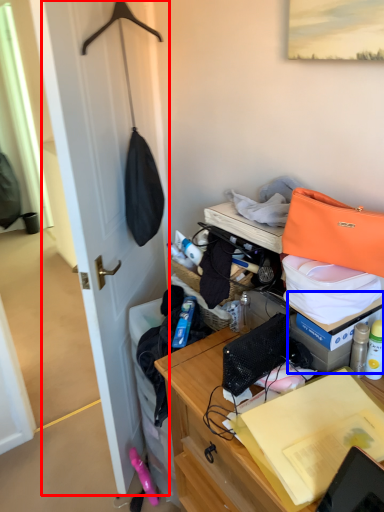
Question: Which of the following is the closest to the observer, door (highlighted by a red box) or box (highlighted by a blue box)?

Choices:
 (A) door
 (B) box

Answer: (A)